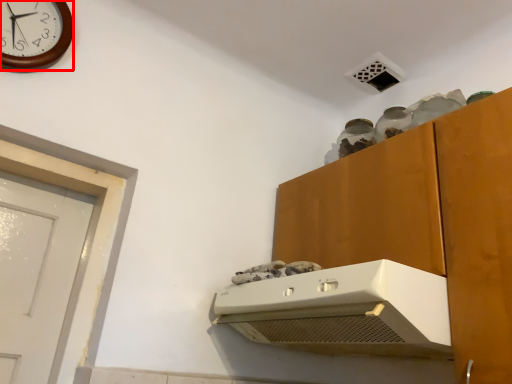
Question: Where is wall clock (annotated by the red box) located in relation to home appliance in the image?

Choices:
 (A) right
 (B) left

Answer: (B)